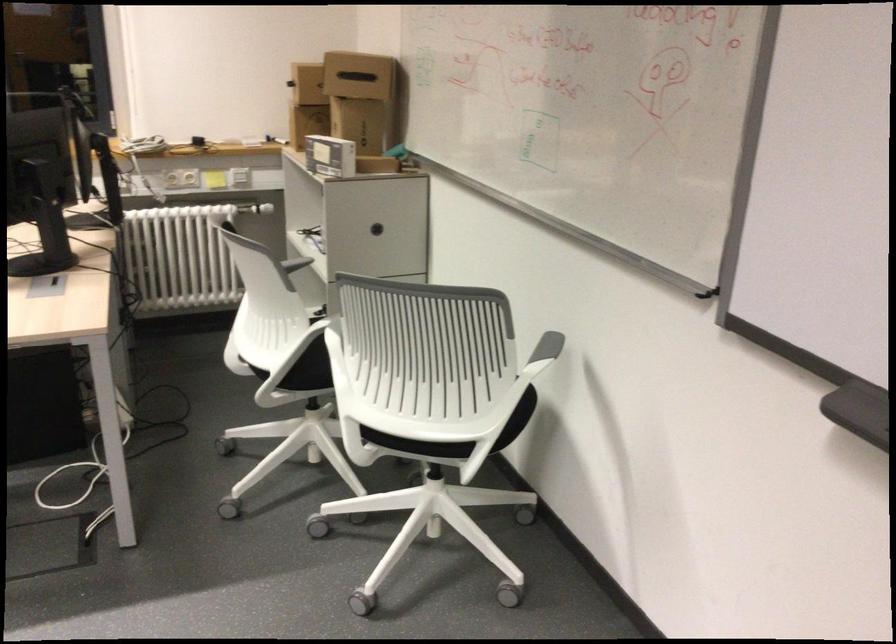
The location [330,156] corresponds to which object?

It refers to a small white box.